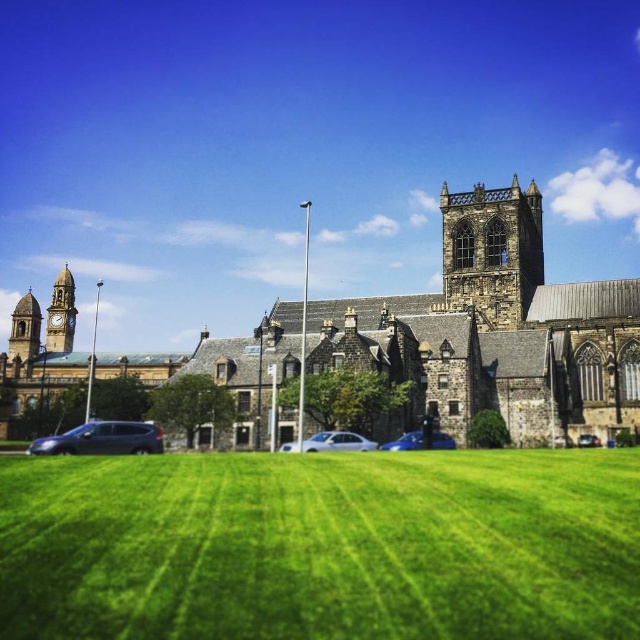
This screenshot has width=640, height=640. Describe the element at coordinates (332, 442) in the screenshot. I see `white matte car at center` at that location.

Between white matte car at center and metallic blue car at center, which one is positioned lower?

metallic blue car at center is below.

Is point (291, 445) behind point (394, 449)?

Yes, it is.

Where is `white matte car at center`? The image size is (640, 640). white matte car at center is located at coordinates pos(332,442).

Is stone clock tower at left positioned behind metallic blue car at center?

Yes, it is.

Who is more distant from viewer, (x=20, y=310) or (x=417, y=438)?

Positioned behind is point (x=20, y=310).

Where is `stone clock tower at left`? Image resolution: width=640 pixels, height=640 pixels. stone clock tower at left is located at coordinates 24,328.

Is point (572, 531) less distant than point (61, 276)?

Yes, it is.

Measure the distance between green grass at lower center and camera.

A distance of 81.63 feet exists between green grass at lower center and camera.

Identify the location of green grass at lower center. This screenshot has height=640, width=640. (321, 545).